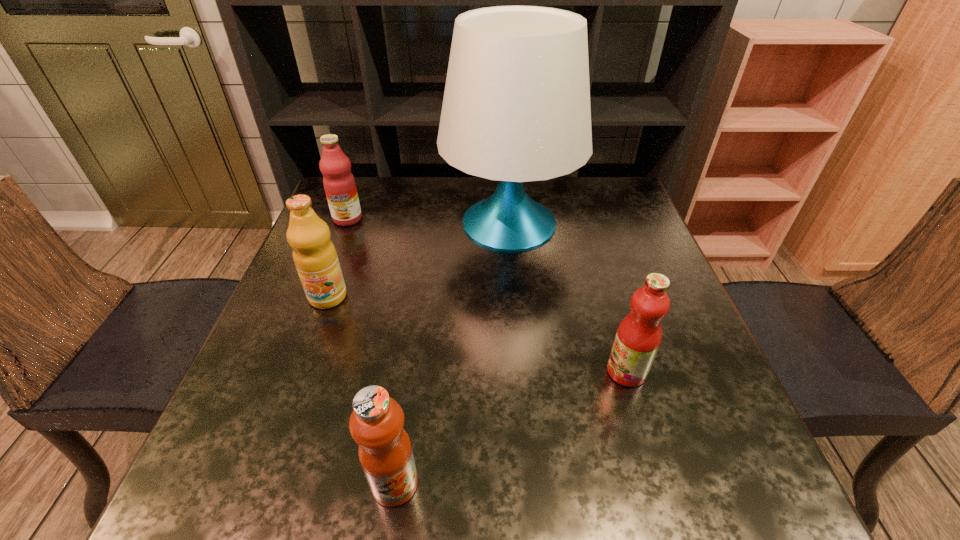
Where is `the tallest object`? Image resolution: width=960 pixels, height=540 pixels. the tallest object is located at coordinates (516, 108).

Locate an element on the screen. the third farthest object is located at coordinates pos(315,257).

Image resolution: width=960 pixels, height=540 pixels. Identify the location of the farthest fruit juice. (339, 184).

The height and width of the screenshot is (540, 960). Find the location of `the fourth farthest object`. the fourth farthest object is located at coordinates (638, 337).

In order to click on the rightmost fruit juice in this screenshot , I will do `click(638, 337)`.

Identify the location of the nearest fruit juice. The height and width of the screenshot is (540, 960). (376, 423).

Locate an element on the screen. the nearest object is located at coordinates pos(376,423).

Where is `vacant space located on the front-facing side of the tallest object`? The height and width of the screenshot is (540, 960). vacant space located on the front-facing side of the tallest object is located at coordinates (527, 413).

Image resolution: width=960 pixels, height=540 pixels. What are the coordinates of `free region located 0.340m on the front label of the third nearest fruit juice` in the screenshot? It's located at coord(266,467).

This screenshot has height=540, width=960. I want to click on blank space located 0.130m on the label of the farthest fruit juice, so click(x=332, y=258).